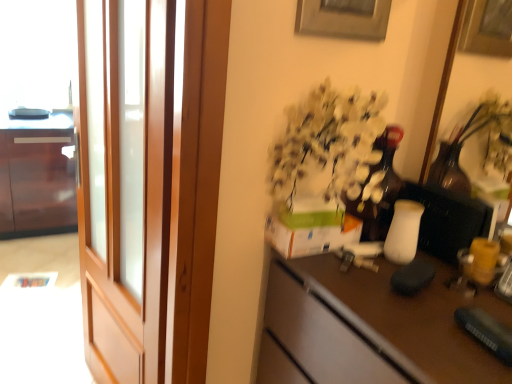
The image size is (512, 384). I want to click on wooden screen door at left, so click(125, 183).

What do you see at coordinates (369, 327) in the screenshot?
I see `brown matte desk at center` at bounding box center [369, 327].

Image resolution: width=512 pixels, height=384 pixels. I want to click on glossy wood cabinet at left, so click(37, 177).

Is brown matte desk at center oriented away from wooden screen door at left?

brown matte desk at center is not turned away from wooden screen door at left.

From a real-world perspective, which object stands above the other?

wooden screen door at left, from a real-world perspective.

Considering the positions of points (359, 305) and (108, 181), is point (359, 305) closer to camera compared to point (108, 181)?

Yes, point (359, 305) is in front of point (108, 181).

Choose the correct answer: Is glossy wood cabinet at left inside wooden screen door at left or outside it?

glossy wood cabinet at left is not inside wooden screen door at left, it's outside.

Which object is positioned more to the right, glossy wood cabinet at left or wooden screen door at left?

From the viewer's perspective, wooden screen door at left appears more on the right side.

Looking at this image, how many degrees apart are the facing directions of glossy wood cabinet at left and wooden screen door at left?

81.9 degrees.

How many degrees apart are the facing directions of wooden screen door at left and brown matte desk at center?

They differ by 8.85 degrees in their facing directions.

Is wooden screen door at left completely or partially outside of brown matte desk at center?

wooden screen door at left is positioned outside brown matte desk at center.

Can you confirm if wooden screen door at left is bigger than brown matte desk at center?

No, wooden screen door at left is not bigger than brown matte desk at center.

In terms of width, does wooden screen door at left look wider or thinner when compared to brown matte desk at center?

In the image, wooden screen door at left appears to be more narrow than brown matte desk at center.

Looking at this image, visually, is brown matte desk at center positioned to the left or to the right of glossy wood cabinet at left?

Clearly, brown matte desk at center is on the right of glossy wood cabinet at left in the image.

Which of these two, brown matte desk at center or glossy wood cabinet at left, is thinner?

With smaller width is brown matte desk at center.

Is brown matte desk at center spatially inside glossy wood cabinet at left, or outside of it?

brown matte desk at center is not enclosed by glossy wood cabinet at left.

You are a GUI agent. You are given a task and a screenshot of the screen. Output one action in this format:
    pyautogui.click(x=<x>, y=<y>)
    Task: Click on the screen door below the glossy wood cabinet at left (from the image's perspective)
    The height and width of the screenshot is (384, 512).
    Given the screenshot: What is the action you would take?
    pyautogui.click(x=125, y=183)

From a real-world perspective, is wooden screen door at left on top of glossy wood cabinet at left?

Yes, from a real-world perspective, wooden screen door at left is above glossy wood cabinet at left.

Does wooden screen door at left have a smaller size compared to glossy wood cabinet at left?

Correct, wooden screen door at left occupies less space than glossy wood cabinet at left.

Looking at this image, is wooden screen door at left in contact with glossy wood cabinet at left?

No, wooden screen door at left is not beside glossy wood cabinet at left.

Is glossy wood cabinet at left looking in the opposite direction of brown matte desk at center?

No, glossy wood cabinet at left's orientation is not away from brown matte desk at center.

Is point (17, 203) positioned in front of point (469, 301)?

That is False.

This screenshot has width=512, height=384. Find the location of `desk above the glossy wood cabinet at left (from a real-world perspective)`. desk above the glossy wood cabinet at left (from a real-world perspective) is located at coordinates (369, 327).

Looking at this image, would you say brown matte desk at center is part of glossy wood cabinet at left's contents?

Definitely not — brown matte desk at center is not inside glossy wood cabinet at left.

The width and height of the screenshot is (512, 384). Identify the location of desk that is under the wooden screen door at left (from a real-world perspective). (369, 327).

Locate an element on the screen. The height and width of the screenshot is (384, 512). cabinetry that appears on the left of wooden screen door at left is located at coordinates (37, 177).

Looking at the image, which one is located closer to glossy wood cabinet at left, wooden screen door at left or brown matte desk at center?

The object closer to glossy wood cabinet at left is wooden screen door at left.

Estimate the real-world distances between objects in this image. Which object is closer to wooden screen door at left, brown matte desk at center or glossy wood cabinet at left?

brown matte desk at center.

From the image, which object appears to be nearer to brown matte desk at center, glossy wood cabinet at left or wooden screen door at left?

The object closer to brown matte desk at center is wooden screen door at left.

Estimate the real-world distances between objects in this image. Which object is closer to wooden screen door at left, glossy wood cabinet at left or brown matte desk at center?

brown matte desk at center.

From the image, which object appears to be farther from glossy wood cabinet at left, brown matte desk at center or wooden screen door at left?

brown matte desk at center.

Estimate the real-world distances between objects in this image. Which object is further from brown matte desk at center, wooden screen door at left or glossy wood cabinet at left?

glossy wood cabinet at left is positioned further to the anchor brown matte desk at center.

In order to click on screen door between glossy wood cabinet at left and brown matte desk at center from left to right in this screenshot , I will do `click(125, 183)`.